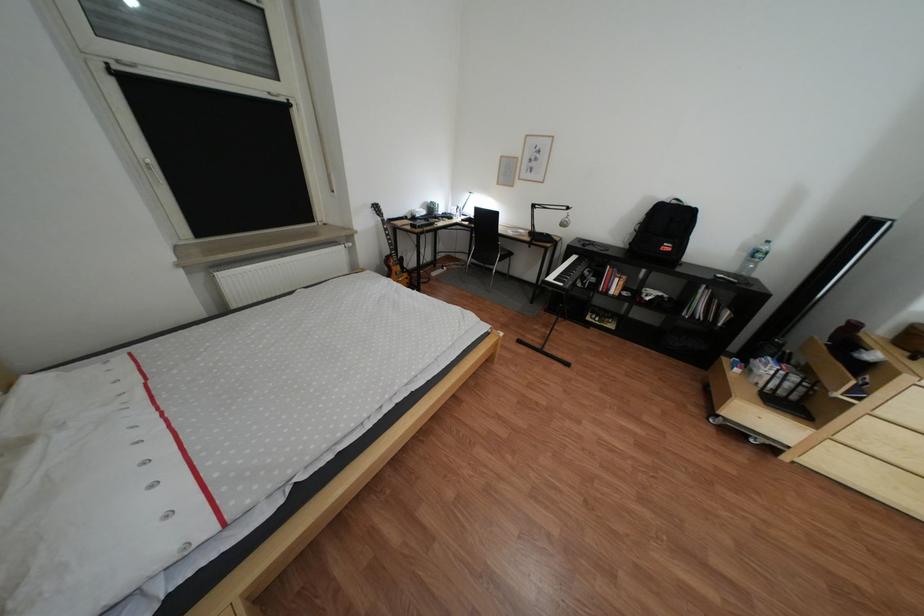
What do you see at coordinates (152, 169) in the screenshot? This screenshot has height=616, width=924. I see `a window shade handle` at bounding box center [152, 169].